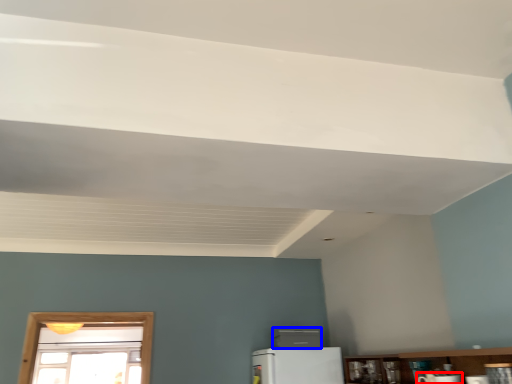
Question: Which of the following is the closest to the observer, appliance (highlighted by a red box) or appliance (highlighted by a blue box)?

Choices:
 (A) appliance
 (B) appliance

Answer: (A)